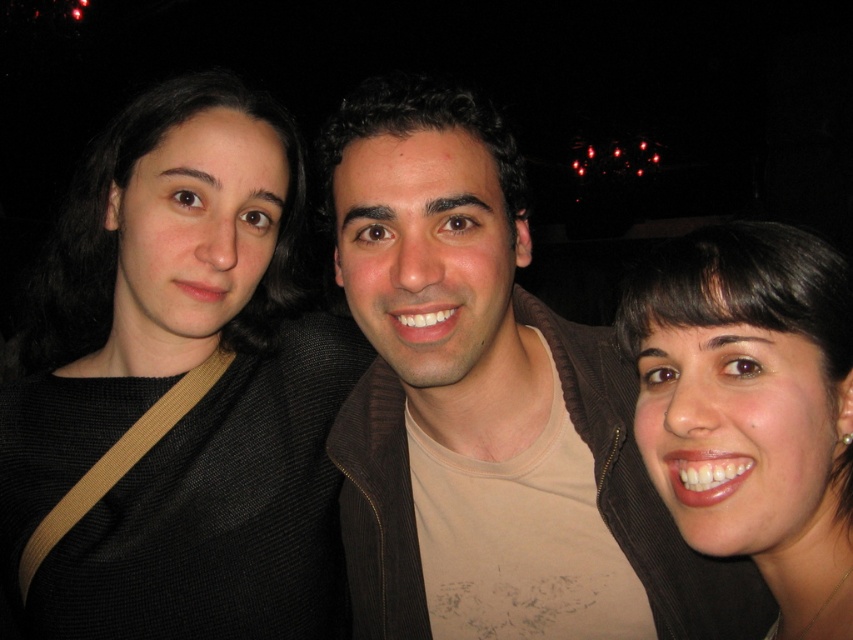
In the scene shown: You are a photographer trying to adjust the lighting for a group photo. You notice the black textured sweater at left and the smooth skin face at center in the frame. Based on their widths, which object should you focus on to ensure proper exposure, considering wider objects might require more light adjustment?

The black textured sweater at left has a greater width than the smooth skin face at center, so you should focus on the black textured sweater at left for proper exposure since it is wider and may need more light adjustment.

You are standing in front of the image and want to locate the black textured sweater at left. According to the coordinates provided, where would you look first?

You should look at point 0.611 on the x axis and 0.209 on the y axis to find the black textured sweater at left.

You are standing in front of the group of three people in the image. You notice two points marked in the scene. Which point, point (41, 444) or point (703, 344), is closer to you?

Point (41, 444) is closer to you than point (703, 344) because it is further to the viewer according to the description.